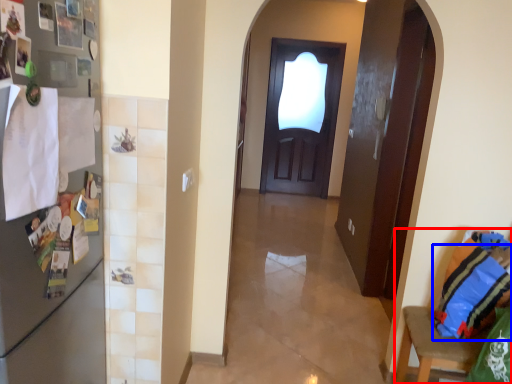
Question: Which object is further to the camera taking this photo, armchair (highlighted by a red box) or pillow (highlighted by a blue box)?

Choices:
 (A) armchair
 (B) pillow

Answer: (B)